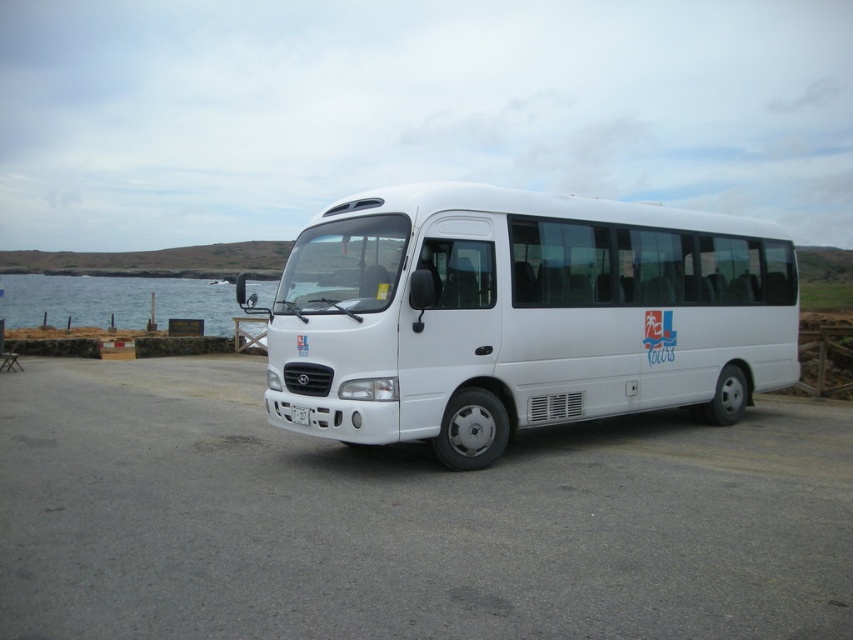
You are planning to park another vehicle behind the white matte bus at center. Based on the scene, can the white asphalt parking lot at center accommodate another vehicle behind the bus?

The white asphalt parking lot at center is larger in size than white matte bus at center, so there is enough space to park another vehicle behind the white matte bus at center.

Based on the photo, you are standing at the back of the white minibus and want to walk towards the blue water at left. According to the scene, which direction should you move relative to the white asphalt parking lot at center?

Since the white asphalt parking lot at center is below the blue water at left, you should move towards the upper direction relative to the white asphalt parking lot at center to reach the blue water at left.

You are standing at the center of the white asphalt parking lot at center. You want to walk to the front of the white minibus. Which direction should you head?

Since the white asphalt parking lot at center is located at point (405, 522), you should head north to reach the front of the white minibus.